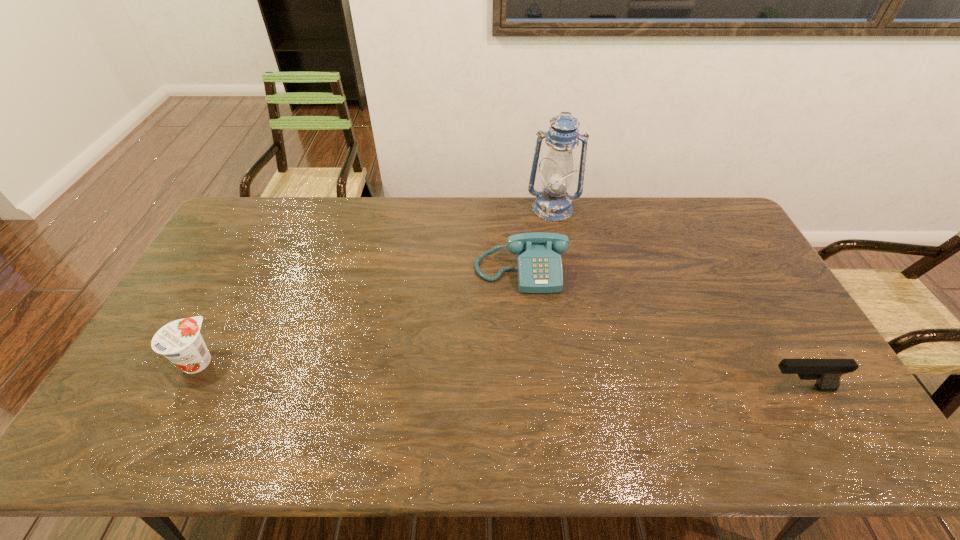
Image resolution: width=960 pixels, height=540 pixels. Identify the location of vacant point located between the third farthest object and the telephone. (359, 316).

What are the coordinates of `free space between the leftmost object and the farthest object` in the screenshot? It's located at (375, 285).

At what (x,y) coordinates should I click in order to perform the action: click on free space between the second farthest object and the nearest object. Please return your answer as a coordinate pair (x, y). Looking at the image, I should click on (660, 329).

The height and width of the screenshot is (540, 960). Find the location of `vacant space that's between the third farthest object and the lantern`. vacant space that's between the third farthest object and the lantern is located at coordinates (375, 285).

Locate an element on the screen. Image resolution: width=960 pixels, height=540 pixels. free space between the rightmost object and the leftmost object is located at coordinates (498, 374).

The image size is (960, 540). I want to click on unoccupied position between the third farthest object and the pistol, so click(498, 374).

Identify the location of free space between the pistol and the third nearest object. (660, 329).

Find the location of a particular element. free space between the second nearest object and the pistol is located at coordinates (498, 374).

At what (x,y) coordinates should I click in order to perform the action: click on object that is the third closest to the tallest object. Please return your answer as a coordinate pair (x, y). This screenshot has width=960, height=540. Looking at the image, I should click on (180, 341).

Identify the location of the second closest object to the nearest object. This screenshot has width=960, height=540. (553, 203).